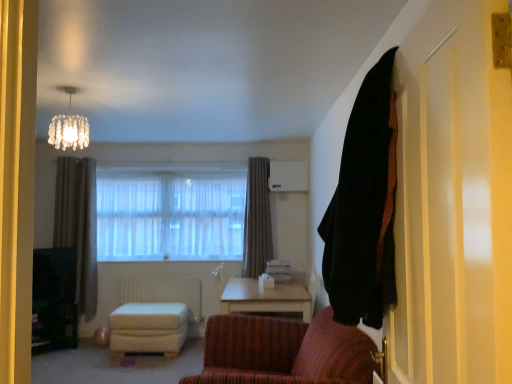
Question: In terms of width, does crystal glass chandelier at upper center look wider or thinner when compared to light wood table at center?

Choices:
 (A) thin
 (B) wide

Answer: (A)

Question: From the image's perspective, is crystal glass chandelier at upper center positioned above or below light wood table at center?

Choices:
 (A) above
 (B) below

Answer: (A)

Question: Considering the real-world distances, which object is closest to the translucent fabric window at center?

Choices:
 (A) white matte radiator at lower center
 (B) brown fabric curtain at center, the 1th curtain viewed from the back
 (C) light wood table at center
 (D) black fabric curtain at upper right, the first curtain positioned from the right
 (E) white fabric stool at center

Answer: (A)

Question: Which object is positioned farthest from the light wood table at center?

Choices:
 (A) translucent fabric window at center
 (B) white fabric stool at center
 (C) white matte radiator at lower center
 (D) crystal glass chandelier at upper center
 (E) black fabric curtain at upper right, the 1th curtain when ordered from front to back

Answer: (E)